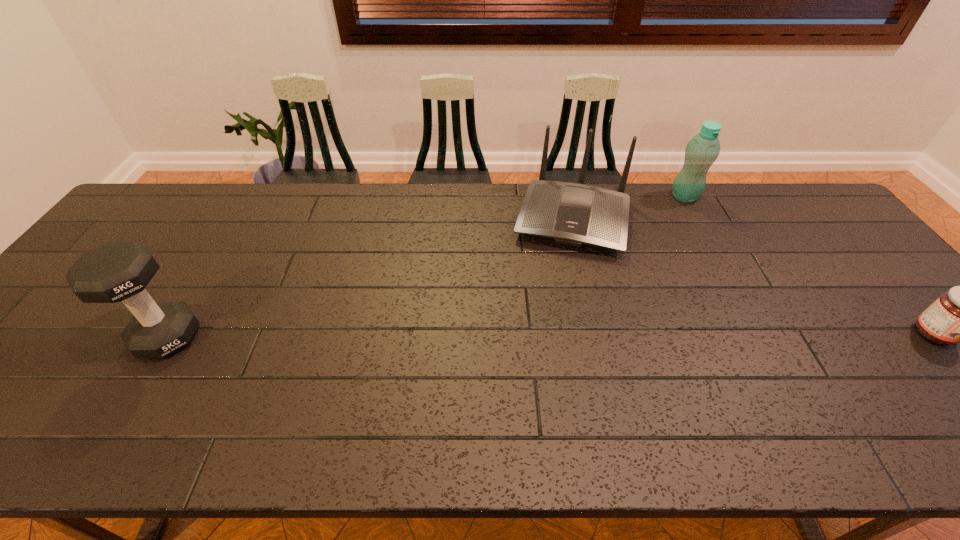
Identify the location of object that is the third closest to the dumbbell. (958, 316).